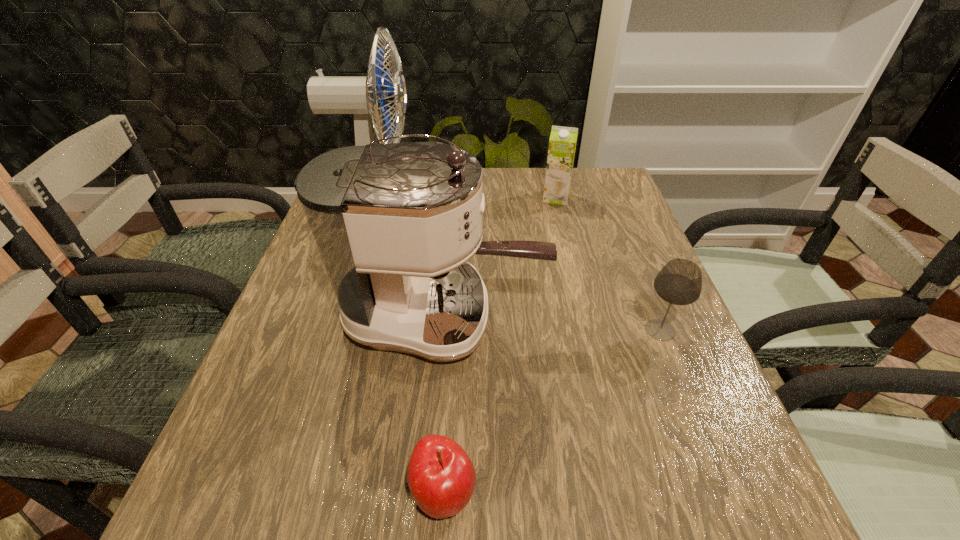
Locate an element on the screen. This screenshot has width=960, height=540. free region located on the left of the soya milk is located at coordinates (x=520, y=198).

The image size is (960, 540). In order to click on free location located 0.320m on the back of the wineglass in this screenshot , I will do `click(618, 224)`.

Identify the location of free space located on the back of the nearest object. (455, 308).

What are the coordinates of `fan at the far edge` in the screenshot? It's located at (364, 96).

Find the location of a particular element. This screenshot has height=540, width=960. soya milk located in the far edge section of the desktop is located at coordinates (562, 144).

You are a GUI agent. You are given a task and a screenshot of the screen. Output one action in this format:
    pyautogui.click(x=<x>, y=<y>)
    Task: Click on the object that is at the near edge
    
    Given the screenshot: What is the action you would take?
    pyautogui.click(x=441, y=477)

In order to click on fan present at the left edge in this screenshot , I will do `click(364, 96)`.

This screenshot has height=540, width=960. I want to click on coffee maker present at the left edge, so click(395, 224).

At what (x,y) coordinates should I click in order to perform the action: click on soya milk that is at the right edge. Please return your answer as a coordinate pair (x, y). The image size is (960, 540). Looking at the image, I should click on (562, 144).

Where is `wineglass that is at the right edge`? This screenshot has height=540, width=960. wineglass that is at the right edge is located at coordinates (679, 282).